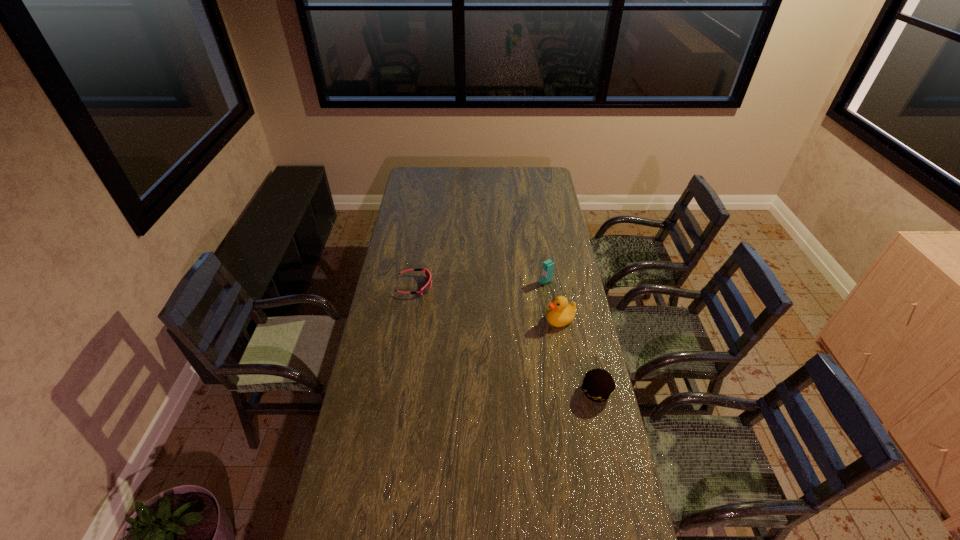
At what (x,y) coordinates should I click in order to perform the action: click on free location located at the beak of the third shortest object. Please return your answer as a coordinate pair (x, y). This screenshot has width=960, height=540. Looking at the image, I should click on (528, 331).

Locate an element on the screen. free space located 0.110m at the beak of the third shortest object is located at coordinates (524, 333).

Locate an element on the screen. blank area located on the keypad of the tallest object is located at coordinates (516, 296).

The image size is (960, 540). I want to click on vacant region located on the keypad of the tallest object, so click(x=493, y=307).

The width and height of the screenshot is (960, 540). Identify the location of free space located on the keypad of the tallest object. (507, 301).

I want to click on object at the left edge, so click(426, 288).

You are a GUI agent. You are given a task and a screenshot of the screen. Output one action in this format:
    pyautogui.click(x=<x>, y=<y>)
    Task: Click on the patty at the right edge
    This screenshot has width=960, height=540.
    Given the screenshot: What is the action you would take?
    pyautogui.click(x=598, y=385)

This screenshot has height=540, width=960. In order to click on duck at the right edge in this screenshot , I will do `click(560, 313)`.

You are a GUI agent. You are given a task and a screenshot of the screen. Output one action in this format:
    pyautogui.click(x=<x>, y=<y>)
    Task: Click on the cellular telephone located in the right edge section of the desktop
    The height and width of the screenshot is (540, 960).
    Given the screenshot: What is the action you would take?
    pyautogui.click(x=548, y=266)

Locate an element on the screen. The width and height of the screenshot is (960, 540). vacant region at the far edge of the desktop is located at coordinates (450, 186).